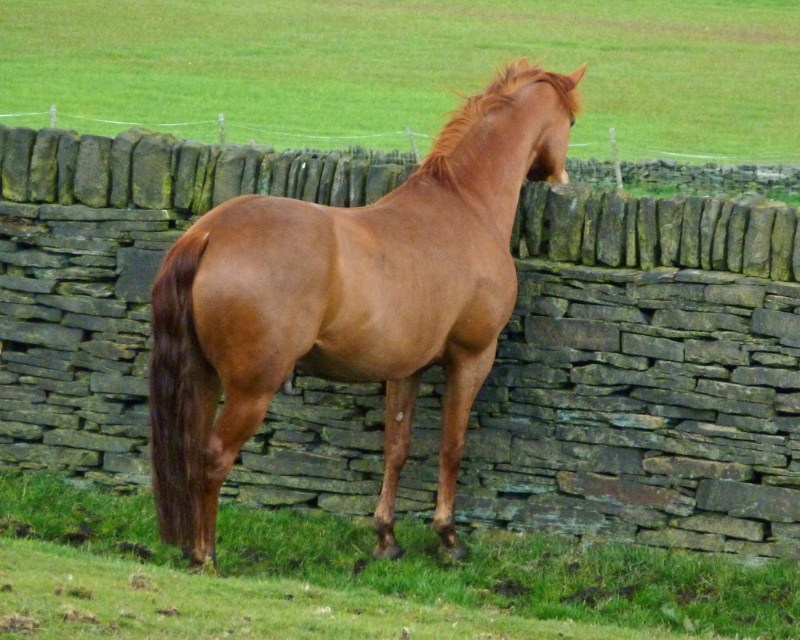
You are a gardener who wants to plant a new flower bed. You notice two patches of green grass at center and green grass at lower center. Which patch is higher up in the image?

The green grass at center is higher up in the image because it is above the green grass at lower center.

You are a photographer trying to capture the brown glossy horse at center and the green grass at lower center in a single frame. Based on their sizes, which object would appear more prominent in the photo?

The brown glossy horse at center would appear more prominent in the photo because it is larger in size than the green grass at lower center.

You are a photographer trying to capture the brown glossy horse at center and the green grass at center in a single shot. Based on their positions, which object should you adjust your camera angle to focus on first if you want to include both in your frame?

The green grass at center is positioned on the left side of the brown glossy horse at center, so you should adjust your camera angle to focus on the brown glossy horse at center first to ensure both the horse and the grass are included in the frame.